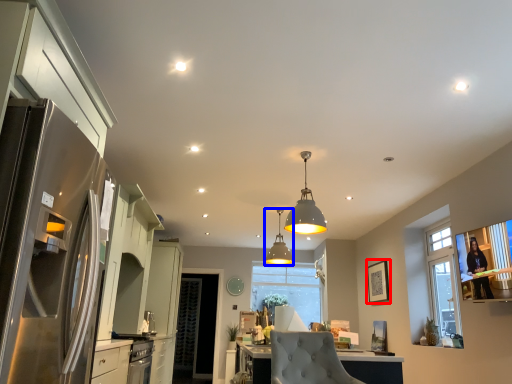
Question: Which object appears farthest to the camera in this image, picture frame (highlighted by a red box) or lamp (highlighted by a blue box)?

Choices:
 (A) picture frame
 (B) lamp

Answer: (A)